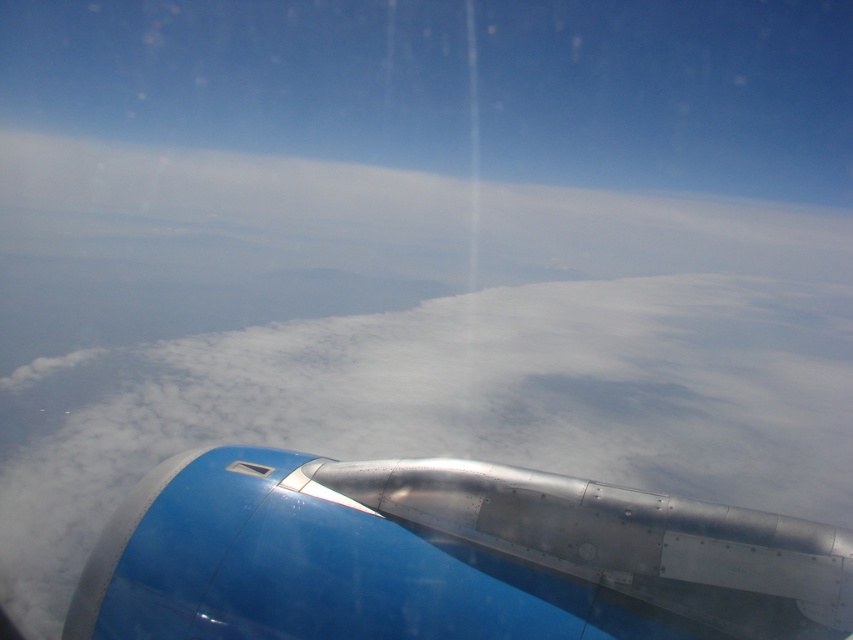
Between metallic blue engine at lower left and transparent plastic airplane window at lower left, which one is positioned higher?

transparent plastic airplane window at lower left is above.

Can you confirm if metallic blue engine at lower left is positioned above transparent plastic airplane window at lower left?

Incorrect, metallic blue engine at lower left is not positioned above transparent plastic airplane window at lower left.

Does point (804, 580) lie behind point (267, 472)?

No.

The image size is (853, 640). What are the coordinates of `metallic blue engine at lower left` in the screenshot? It's located at (445, 557).